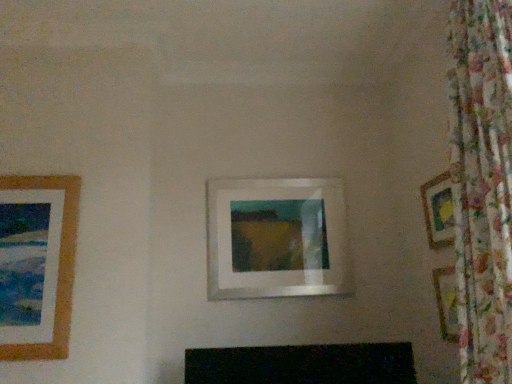
Question: Is brown wooden picture frame at left, which is the third picture frame in right-to-left order, located outside wooden picture frame at right, which appears as the first picture frame when viewed from the right?

Choices:
 (A) no
 (B) yes

Answer: (B)

Question: Considering the relative sizes of brown wooden picture frame at left, which is the third picture frame in right-to-left order, and wooden picture frame at right, which ranks as the third picture frame in left-to-right order, in the image provided, is brown wooden picture frame at left, which is the third picture frame in right-to-left order, smaller than wooden picture frame at right, which ranks as the third picture frame in left-to-right order,?

Choices:
 (A) no
 (B) yes

Answer: (A)

Question: Is brown wooden picture frame at left, which is the first picture frame from left to right, positioned in front of wooden picture frame at right, which ranks as the third picture frame in left-to-right order?

Choices:
 (A) yes
 (B) no

Answer: (A)

Question: Is brown wooden picture frame at left, which is the third picture frame in right-to-left order, taller than wooden picture frame at right, which appears as the first picture frame when viewed from the right?

Choices:
 (A) yes
 (B) no

Answer: (A)

Question: Could you tell me if brown wooden picture frame at left, which is the first picture frame from left to right, is turned towards wooden picture frame at right, which ranks as the third picture frame in left-to-right order?

Choices:
 (A) no
 (B) yes

Answer: (A)

Question: Does brown wooden picture frame at left, which is the third picture frame in right-to-left order, have a larger size compared to wooden picture frame at right, which appears as the first picture frame when viewed from the right?

Choices:
 (A) no
 (B) yes

Answer: (B)

Question: From a real-world perspective, is wooden picture frame at right, which ranks as the third picture frame in left-to-right order, located beneath white matte picture frame at center, which appears as the second picture frame when viewed from the left?

Choices:
 (A) no
 (B) yes

Answer: (A)

Question: Is wooden picture frame at right, which appears as the first picture frame when viewed from the right, further to camera compared to white matte picture frame at center, the 2th picture frame viewed from the right?

Choices:
 (A) yes
 (B) no

Answer: (B)

Question: Is wooden picture frame at right, which appears as the first picture frame when viewed from the right, not near white matte picture frame at center, which appears as the second picture frame when viewed from the left?

Choices:
 (A) no
 (B) yes

Answer: (A)

Question: Does wooden picture frame at right, which appears as the first picture frame when viewed from the right, appear on the left side of white matte picture frame at center, the 2th picture frame viewed from the right?

Choices:
 (A) yes
 (B) no

Answer: (B)

Question: Does wooden picture frame at right, which appears as the first picture frame when viewed from the right, have a smaller size compared to white matte picture frame at center, which appears as the second picture frame when viewed from the left?

Choices:
 (A) yes
 (B) no

Answer: (A)

Question: Could you tell me if wooden picture frame at right, which appears as the first picture frame when viewed from the right, is turned towards white matte picture frame at center, which appears as the second picture frame when viewed from the left?

Choices:
 (A) no
 (B) yes

Answer: (A)

Question: From a real-world perspective, is white matte picture frame at center, which appears as the second picture frame when viewed from the left, over brown wooden picture frame at left, which is the third picture frame in right-to-left order?

Choices:
 (A) no
 (B) yes

Answer: (B)